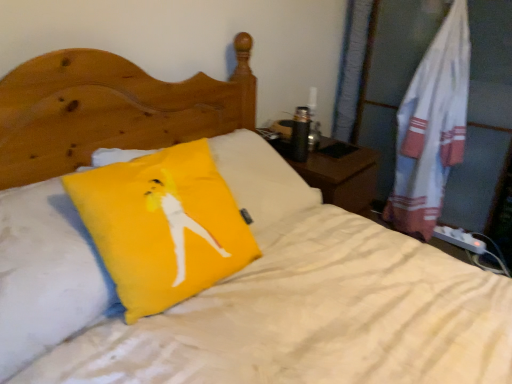
Describe the element at coordinates (431, 127) in the screenshot. I see `white cotton towel at right` at that location.

Identify the location of white cotton towel at right. (431, 127).

Measure the distance between point (49, 222) and camera.

Point (49, 222) and camera are 1.00 meters apart from each other.

Find the location of a particular element. This screenshot has width=512, height=384. yellow fabric pillow at center, arranged as the 1th pillow when viewed from the right is located at coordinates (163, 226).

From a real-world perspective, is yellow fabric pillow at center, arranged as the 1th pillow when viewed from the right, positioned above or below yellow fabric pillow at center, which is the first pillow in left-to-right order?

yellow fabric pillow at center, arranged as the 1th pillow when viewed from the right, is above yellow fabric pillow at center, which is the first pillow in left-to-right order.

Would you say yellow fabric pillow at center, arranged as the 1th pillow when viewed from the right, is a long distance from yellow fabric pillow at center, placed as the second pillow when sorted from right to left?

yellow fabric pillow at center, arranged as the 1th pillow when viewed from the right, is near yellow fabric pillow at center, placed as the second pillow when sorted from right to left, not far away.

In the image, is yellow fabric pillow at center, acting as the 2th pillow starting from the left, positioned in front of or behind yellow fabric pillow at center, which is the first pillow in left-to-right order?

Visually, yellow fabric pillow at center, acting as the 2th pillow starting from the left, is located behind yellow fabric pillow at center, which is the first pillow in left-to-right order.

Can you confirm if yellow fabric pillow at center, acting as the 2th pillow starting from the left, is wider than yellow fabric pillow at center, placed as the second pillow when sorted from right to left?

No, yellow fabric pillow at center, acting as the 2th pillow starting from the left, is not wider than yellow fabric pillow at center, placed as the second pillow when sorted from right to left.

Can you tell me how much yellow fabric pillow at center, arranged as the 1th pillow when viewed from the right, and white cotton towel at right differ in facing direction?

yellow fabric pillow at center, arranged as the 1th pillow when viewed from the right, and white cotton towel at right are facing 79.7 degrees away from each other.

Is yellow fabric pillow at center, acting as the 2th pillow starting from the left, far from white cotton towel at right?

Indeed, yellow fabric pillow at center, acting as the 2th pillow starting from the left, is not near white cotton towel at right.

Consider the image. Does yellow fabric pillow at center, arranged as the 1th pillow when viewed from the right, have a lesser width compared to white cotton towel at right?

Yes.

Is yellow fabric pillow at center, acting as the 2th pillow starting from the left, turned away from white cotton towel at right?

No, yellow fabric pillow at center, acting as the 2th pillow starting from the left,'s orientation is not away from white cotton towel at right.

Could you tell me if white cotton towel at right is facing yellow fabric pillow at center, placed as the second pillow when sorted from right to left?

Yes, white cotton towel at right is aimed at yellow fabric pillow at center, placed as the second pillow when sorted from right to left.

Is white cotton towel at right wider than yellow fabric pillow at center, which is the first pillow in left-to-right order?

In fact, white cotton towel at right might be narrower than yellow fabric pillow at center, which is the first pillow in left-to-right order.

From the picture: What's the angular difference between white cotton towel at right and yellow fabric pillow at center, which is the first pillow in left-to-right order,'s facing directions?

There is a 100-degree angle between the facing directions of white cotton towel at right and yellow fabric pillow at center, which is the first pillow in left-to-right order.

Is white cotton towel at right spatially inside yellow fabric pillow at center, which is the first pillow in left-to-right order, or outside of it?

white cotton towel at right is outside yellow fabric pillow at center, which is the first pillow in left-to-right order.

Is white cotton towel at right positioned with its back to yellow fabric pillow at center, acting as the 2th pillow starting from the left?

No, white cotton towel at right's orientation is not away from yellow fabric pillow at center, acting as the 2th pillow starting from the left.

Considering the sizes of objects white cotton towel at right and yellow fabric pillow at center, arranged as the 1th pillow when viewed from the right, in the image provided, who is taller, white cotton towel at right or yellow fabric pillow at center, arranged as the 1th pillow when viewed from the right,?

Standing taller between the two is white cotton towel at right.

Is the depth of white cotton towel at right greater than that of yellow fabric pillow at center, arranged as the 1th pillow when viewed from the right?

That is True.

Is white cotton towel at right thinner than yellow fabric pillow at center, arranged as the 1th pillow when viewed from the right?

No, white cotton towel at right is not thinner than yellow fabric pillow at center, arranged as the 1th pillow when viewed from the right.

From the image's perspective, is yellow fabric pillow at center, placed as the second pillow when sorted from right to left, positioned above or below white cotton towel at right?

yellow fabric pillow at center, placed as the second pillow when sorted from right to left, is situated lower than white cotton towel at right in the image.

Is yellow fabric pillow at center, which is the first pillow in left-to-right order, behind white cotton towel at right?

No.

The image size is (512, 384). There is a white cotton towel at right. What are the coordinates of `the 2nd pillow below it (from the image's perspective)` in the screenshot? It's located at (46, 274).

Is yellow fabric pillow at center, which is the first pillow in left-to-right order, taller or shorter than yellow fabric pillow at center, acting as the 2th pillow starting from the left?

yellow fabric pillow at center, which is the first pillow in left-to-right order, is taller than yellow fabric pillow at center, acting as the 2th pillow starting from the left.

Is yellow fabric pillow at center, which is the first pillow in left-to-right order, with yellow fabric pillow at center, arranged as the 1th pillow when viewed from the right?

No, yellow fabric pillow at center, which is the first pillow in left-to-right order, is not touching yellow fabric pillow at center, arranged as the 1th pillow when viewed from the right.

How many degrees apart are the facing directions of yellow fabric pillow at center, placed as the second pillow when sorted from right to left, and yellow fabric pillow at center, acting as the 2th pillow starting from the left?

The facing directions of yellow fabric pillow at center, placed as the second pillow when sorted from right to left, and yellow fabric pillow at center, acting as the 2th pillow starting from the left, are 20.8 degrees apart.

From the picture: Is yellow fabric pillow at center, which is the first pillow in left-to-right order, wider or thinner than yellow fabric pillow at center, acting as the 2th pillow starting from the left?

yellow fabric pillow at center, which is the first pillow in left-to-right order, is wider than yellow fabric pillow at center, acting as the 2th pillow starting from the left.

Locate an element on the screen. The height and width of the screenshot is (384, 512). pillow lying on the left of yellow fabric pillow at center, arranged as the 1th pillow when viewed from the right is located at coordinates tap(46, 274).

Find the location of `pillow above the white cotton towel at right (from a real-world perspective)`. pillow above the white cotton towel at right (from a real-world perspective) is located at coordinates (163, 226).

From the image, which object appears to be nearer to yellow fabric pillow at center, arranged as the 1th pillow when viewed from the right, yellow fabric pillow at center, placed as the second pillow when sorted from right to left, or white cotton towel at right?

Among the two, yellow fabric pillow at center, placed as the second pillow when sorted from right to left, is located nearer to yellow fabric pillow at center, arranged as the 1th pillow when viewed from the right.

When comparing their distances from white cotton towel at right, does yellow fabric pillow at center, arranged as the 1th pillow when viewed from the right, or yellow fabric pillow at center, placed as the second pillow when sorted from right to left, seem closer?

yellow fabric pillow at center, arranged as the 1th pillow when viewed from the right.

When comparing their distances from yellow fabric pillow at center, arranged as the 1th pillow when viewed from the right, does white cotton towel at right or yellow fabric pillow at center, placed as the second pillow when sorted from right to left, seem further?

white cotton towel at right lies further to yellow fabric pillow at center, arranged as the 1th pillow when viewed from the right, than the other object.

Based on the photo, looking at the image, which one is located closer to yellow fabric pillow at center, which is the first pillow in left-to-right order, white cotton towel at right or yellow fabric pillow at center, acting as the 2th pillow starting from the left?

yellow fabric pillow at center, acting as the 2th pillow starting from the left, lies closer to yellow fabric pillow at center, which is the first pillow in left-to-right order, than the other object.

Looking at the image, which one is located closer to white cotton towel at right, yellow fabric pillow at center, which is the first pillow in left-to-right order, or yellow fabric pillow at center, acting as the 2th pillow starting from the left?

yellow fabric pillow at center, acting as the 2th pillow starting from the left, lies closer to white cotton towel at right than the other object.

Looking at the image, which one is located further to yellow fabric pillow at center, placed as the second pillow when sorted from right to left, yellow fabric pillow at center, acting as the 2th pillow starting from the left, or white cotton towel at right?

Based on the image, white cotton towel at right appears to be further to yellow fabric pillow at center, placed as the second pillow when sorted from right to left.

Identify the location of pillow between yellow fabric pillow at center, which is the first pillow in left-to-right order, and white cotton towel at right. (163, 226).